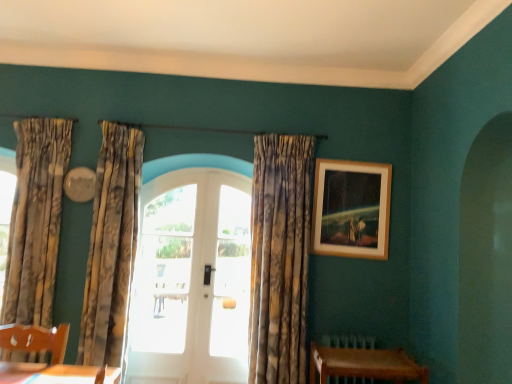
Question: Is white glass door at center, which is the first window from right to left, further to the viewer compared to textured beige curtains at left, which ranks as the second curtain in left-to-right order?

Choices:
 (A) yes
 (B) no

Answer: (A)

Question: Is white glass door at center, the second window viewed from the left, not within textured beige curtains at left, the 2th curtain from the right?

Choices:
 (A) yes
 (B) no

Answer: (A)

Question: Does white glass door at center, the second window viewed from the left, have a lesser height compared to textured beige curtains at left, which ranks as the second curtain in left-to-right order?

Choices:
 (A) no
 (B) yes

Answer: (B)

Question: Would you consider white glass door at center, the second window viewed from the left, to be distant from textured beige curtains at left, the 2th curtain from the right?

Choices:
 (A) yes
 (B) no

Answer: (B)

Question: Does white glass door at center, the second window viewed from the left, have a smaller size compared to textured beige curtains at left, which ranks as the second curtain in left-to-right order?

Choices:
 (A) no
 (B) yes

Answer: (B)

Question: From their relative heights in the image, would you say wooden frame at upper right is taller or shorter than textured gold curtain at center, which is counted as the 1th curtain, starting from the right?

Choices:
 (A) short
 (B) tall

Answer: (A)

Question: In terms of width, does wooden frame at upper right look wider or thinner when compared to textured gold curtain at center, which is counted as the 1th curtain, starting from the right?

Choices:
 (A) thin
 (B) wide

Answer: (A)

Question: Visually, is wooden frame at upper right positioned to the left or to the right of textured gold curtain at center, which is counted as the 1th curtain, starting from the right?

Choices:
 (A) right
 (B) left

Answer: (A)

Question: Is wooden frame at upper right inside or outside of textured gold curtain at center, the third curtain from the left?

Choices:
 (A) outside
 (B) inside

Answer: (A)

Question: Considering the positions of white glass door at center, the 1th window when ordered from left to right, and wooden frame at upper right in the image, is white glass door at center, the 1th window when ordered from left to right, bigger or smaller than wooden frame at upper right?

Choices:
 (A) big
 (B) small

Answer: (A)

Question: Visually, is white glass door at center, the 1th window when ordered from left to right, positioned to the left or to the right of wooden frame at upper right?

Choices:
 (A) right
 (B) left

Answer: (B)

Question: Considering the positions of point (155, 327) and point (365, 195), is point (155, 327) closer or farther from the camera than point (365, 195)?

Choices:
 (A) closer
 (B) farther

Answer: (B)

Question: From their relative heights in the image, would you say white glass door at center, the 1th window when ordered from left to right, is taller or shorter than wooden frame at upper right?

Choices:
 (A) short
 (B) tall

Answer: (B)

Question: Based on their positions, is white glossy door at center located to the left or right of wooden table at lower right?

Choices:
 (A) right
 (B) left

Answer: (B)

Question: In terms of height, does white glossy door at center look taller or shorter compared to wooden table at lower right?

Choices:
 (A) tall
 (B) short

Answer: (A)